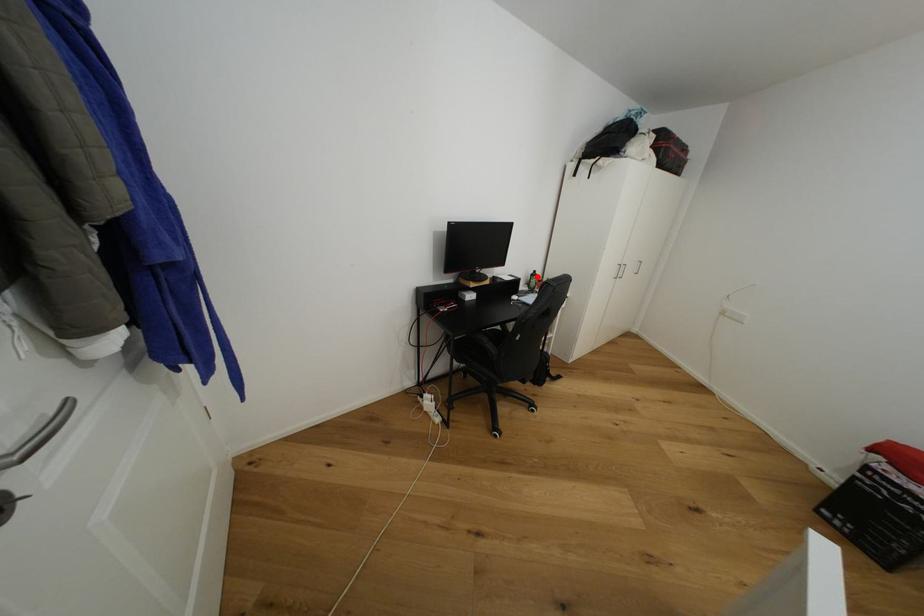
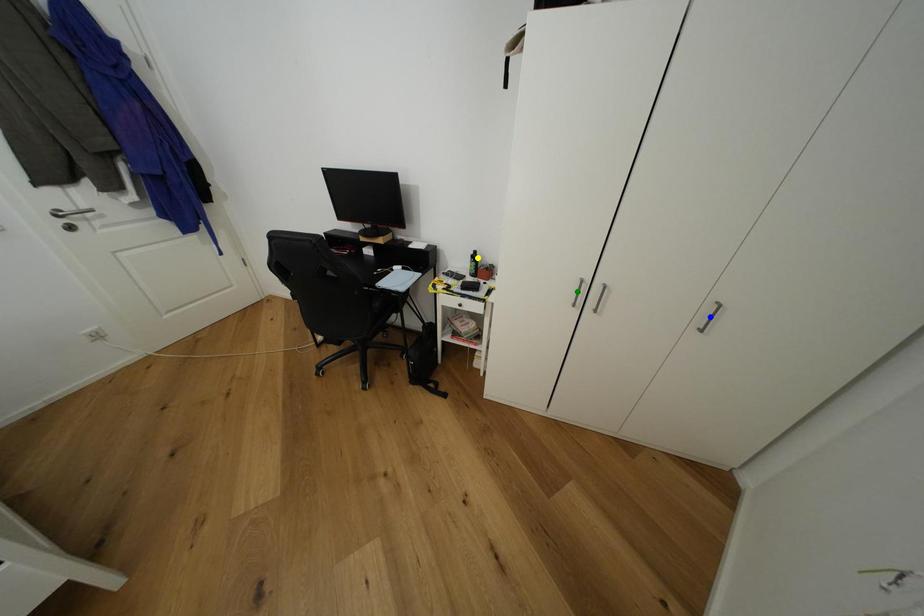
Question: I am providing you with two images of the same scene from different viewpoints. A red point is marked on the first image. You are given multiple points on the second image. Which point in image 2 represents the same 3d spot as the red point in image 1?

Choices:
 (A) blue point
 (B) green point
 (C) yellow point

Answer: (C)